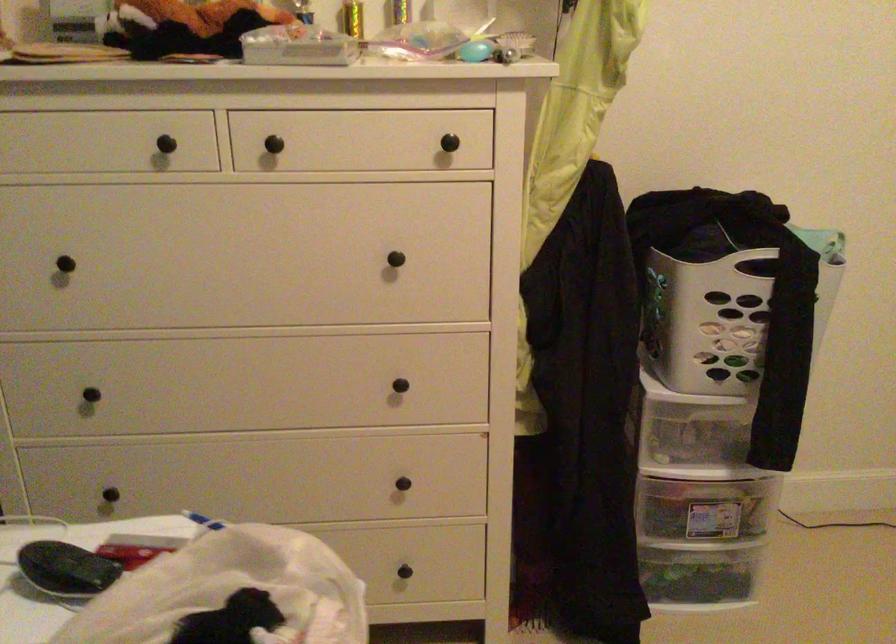
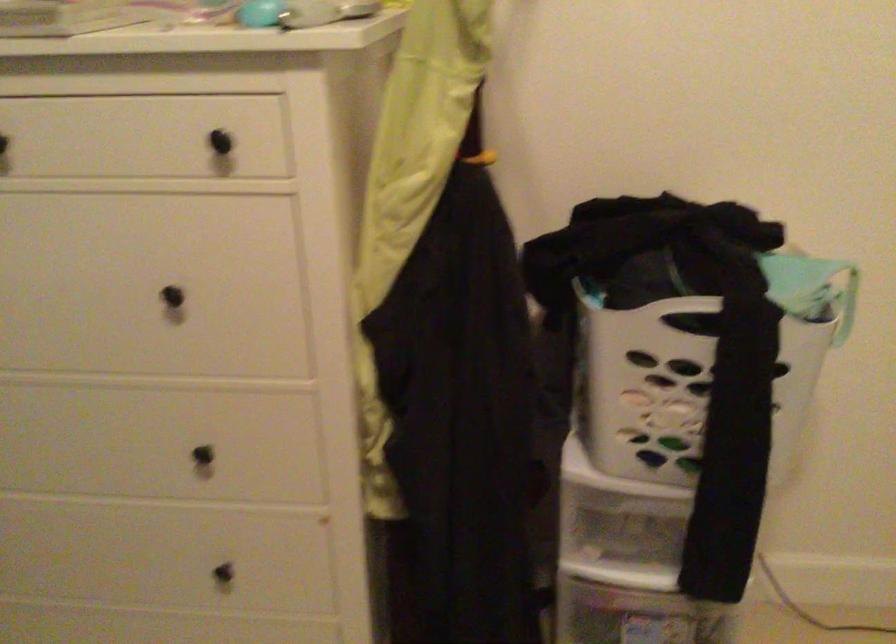
The point at (402, 478) is marked in the first image. Where is the corresponding point in the second image?

(226, 564)